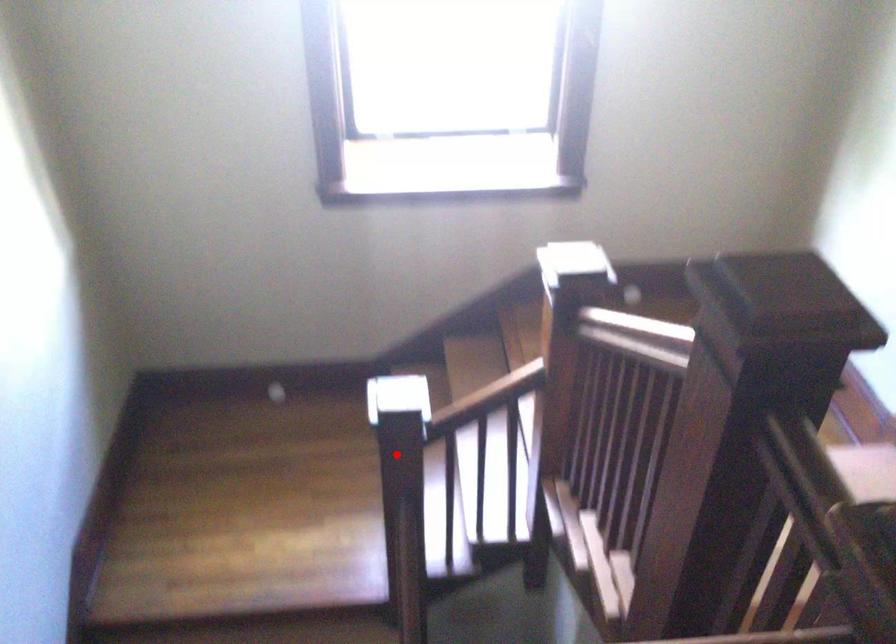
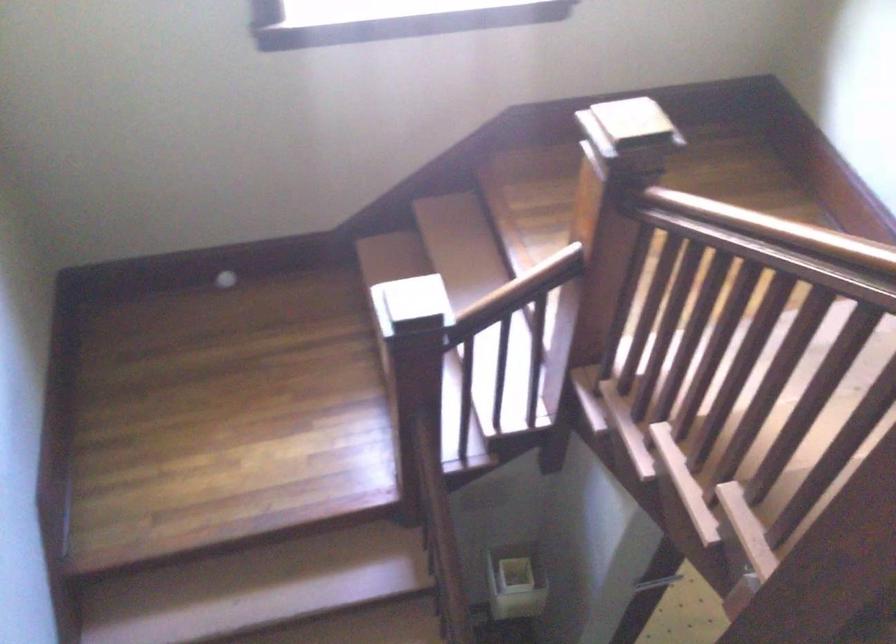
Question: I am providing you with two images of the same scene from different viewpoints. A red point is shown in image1. For the corresponding object point in image2, is it positioned nearer or farther from the camera?

Choices:
 (A) Nearer
 (B) Farther

Answer: (A)